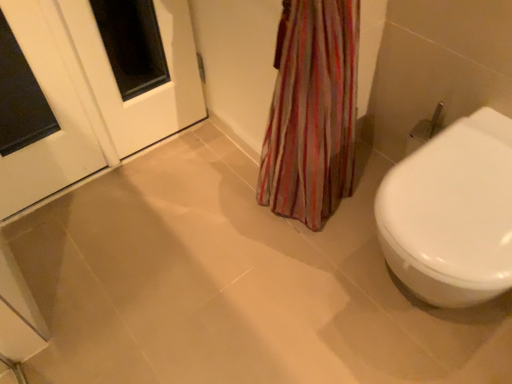
I want to click on free region under white glossy door at upper left (from a real-world perspective), so click(165, 152).